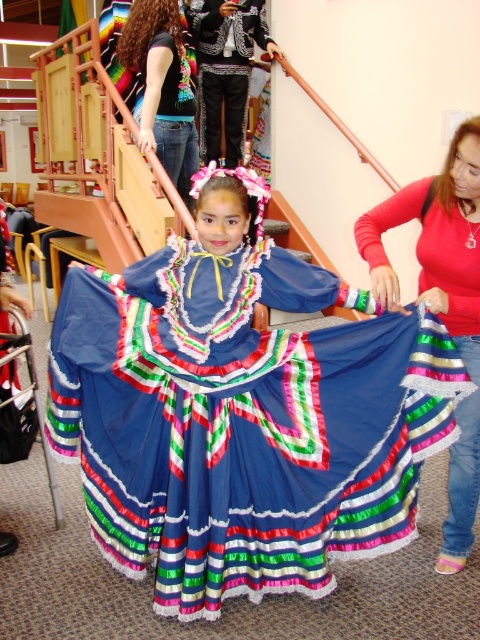
From the picture: Is blue satin dress at center positioned before jeans at upper left?

Yes.

This screenshot has height=640, width=480. In order to click on blue satin dress at center in this screenshot , I will do `click(241, 412)`.

Which of these two, blue satin dress at center or matte blue skirt at center, stands shorter?

Standing shorter between the two is blue satin dress at center.

Does blue satin dress at center appear under matte blue skirt at center?

Yes.

The image size is (480, 640). I want to click on blue satin dress at center, so tap(241, 412).

The image size is (480, 640). I want to click on blue satin dress at center, so click(x=241, y=412).

Can you confirm if matte blue skirt at center is positioned above embroidered velvet vest at upper center?

No, matte blue skirt at center is not above embroidered velvet vest at upper center.

Does matte blue skirt at center have a lesser height compared to embroidered velvet vest at upper center?

Incorrect, matte blue skirt at center's height does not fall short of embroidered velvet vest at upper center's.

Where is `matte blue skirt at center`? matte blue skirt at center is located at coordinates pos(443,301).